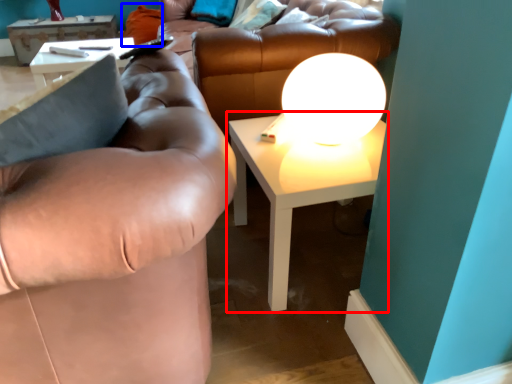
Question: Which point is closer to the camera, table (highlighted by a red box) or pillow (highlighted by a blue box)?

Choices:
 (A) table
 (B) pillow

Answer: (A)